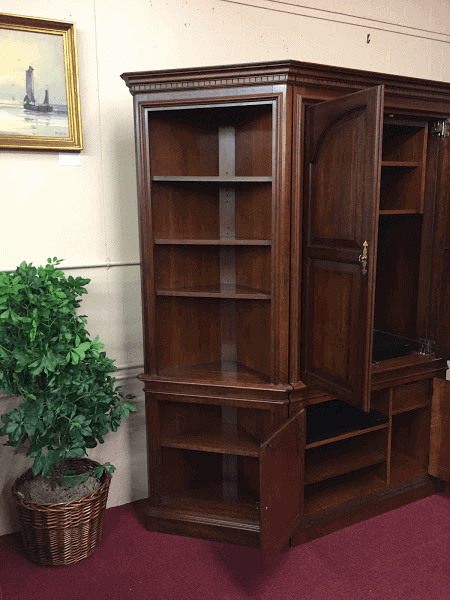
Locate an element on the screen. The image size is (450, 600). wall is located at coordinates (150, 35).